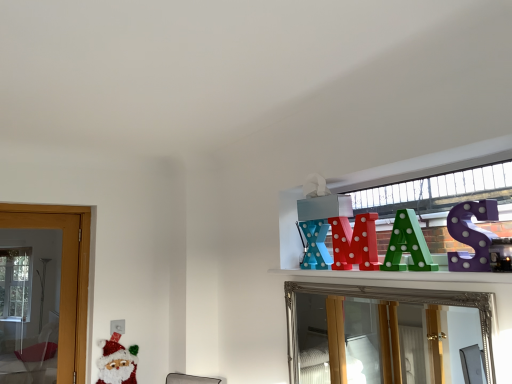
Question: Considering the relative sizes of purple polka dot letter at upper right, the first toy from the right, and shiny red letter at upper center, which is the 2th toy from back to front, in the image provided, is purple polka dot letter at upper right, the first toy from the right, wider than shiny red letter at upper center, which is the 2th toy from back to front,?

Choices:
 (A) yes
 (B) no

Answer: (B)

Question: Is purple polka dot letter at upper right, which appears as the 1th toy when viewed from the front, not inside shiny red letter at upper center, which is the 2th toy from back to front?

Choices:
 (A) no
 (B) yes

Answer: (B)

Question: Is purple polka dot letter at upper right, which appears as the 1th toy when viewed from the front, bigger than shiny red letter at upper center, which is the 2th toy from back to front?

Choices:
 (A) no
 (B) yes

Answer: (A)

Question: Is purple polka dot letter at upper right, the fourth toy positioned from the left, facing away from shiny red letter at upper center, arranged as the third toy when viewed from the right?

Choices:
 (A) yes
 (B) no

Answer: (B)

Question: Is purple polka dot letter at upper right, the fourth toy positioned from the left, positioned far away from shiny red letter at upper center, which is counted as the second toy, starting from the left?

Choices:
 (A) no
 (B) yes

Answer: (A)

Question: From the image's perspective, is purple polka dot letter at upper right, arranged as the 4th toy when viewed from the back, located above or below shiny red letter at upper center, which is counted as the second toy, starting from the left?

Choices:
 (A) above
 (B) below

Answer: (A)

Question: Considering the positions of point (493, 218) and point (356, 230), is point (493, 218) closer or farther from the camera than point (356, 230)?

Choices:
 (A) closer
 (B) farther

Answer: (A)

Question: Considering the positions of purple polka dot letter at upper right, the fourth toy positioned from the left, and shiny red letter at upper center, which is counted as the second toy, starting from the left, in the image, is purple polka dot letter at upper right, the fourth toy positioned from the left, taller or shorter than shiny red letter at upper center, which is counted as the second toy, starting from the left,?

Choices:
 (A) short
 (B) tall

Answer: (A)

Question: In terms of size, does purple polka dot letter at upper right, the fourth toy positioned from the left, appear bigger or smaller than shiny red letter at upper center, which is counted as the second toy, starting from the left?

Choices:
 (A) big
 (B) small

Answer: (B)

Question: From the image's perspective, relative to purple polka dot letter at upper right, the first toy from the right, is matte plastic letter x at upper center, which is counted as the 4th toy, starting from the front, above or below?

Choices:
 (A) below
 (B) above

Answer: (A)

Question: Relative to purple polka dot letter at upper right, the fourth toy positioned from the left, is matte plastic letter x at upper center, which ranks as the 4th toy in right-to-left order, in front or behind?

Choices:
 (A) front
 (B) behind

Answer: (B)

Question: Is matte plastic letter x at upper center, which is counted as the 4th toy, starting from the front, situated inside purple polka dot letter at upper right, which appears as the 1th toy when viewed from the front, or outside?

Choices:
 (A) inside
 (B) outside

Answer: (B)

Question: Based on their sizes in the image, would you say matte plastic letter x at upper center, which is counted as the 4th toy, starting from the front, is bigger or smaller than purple polka dot letter at upper right, the fourth toy positioned from the left?

Choices:
 (A) big
 (B) small

Answer: (A)

Question: From their relative heights in the image, would you say purple polka dot letter at upper right, arranged as the 4th toy when viewed from the back, is taller or shorter than silver/glass mirror at upper center?

Choices:
 (A) tall
 (B) short

Answer: (B)

Question: Is purple polka dot letter at upper right, the first toy from the right, wider or thinner than silver/glass mirror at upper center?

Choices:
 (A) thin
 (B) wide

Answer: (A)